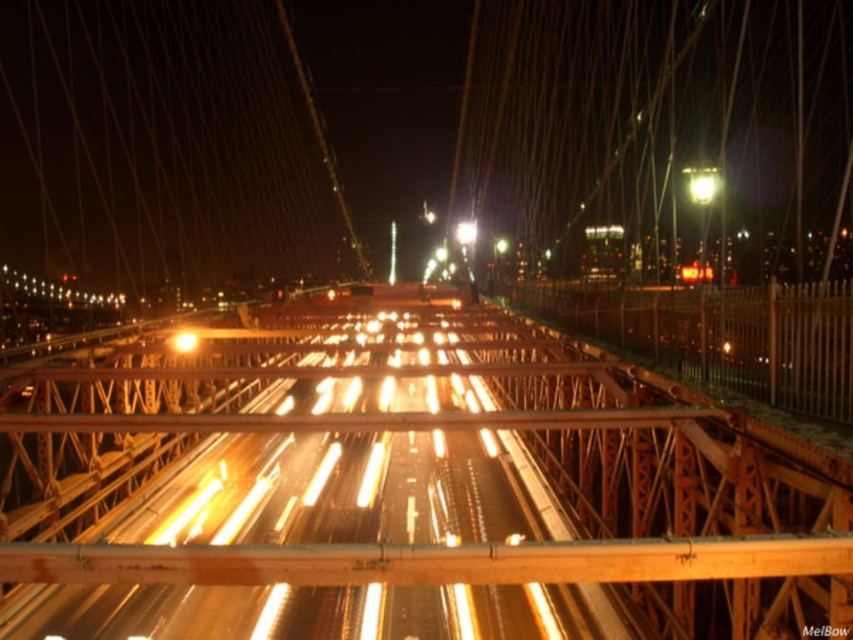
Question: Among these points, which one is farthest from the camera?

Choices:
 (A) (195, 339)
 (B) (460, 243)

Answer: (B)

Question: Can you confirm if yellow metallic light at center is positioned below bright metallic streetlight at center?

Choices:
 (A) no
 (B) yes

Answer: (B)

Question: Where is yellow metallic light at center located in relation to bright metallic streetlight at center in the image?

Choices:
 (A) below
 (B) above

Answer: (A)

Question: Which point is closer to the camera taking this photo?

Choices:
 (A) (190, 348)
 (B) (456, 234)

Answer: (A)

Question: Is yellow metallic light at center bigger than bright metallic streetlight at center?

Choices:
 (A) yes
 (B) no

Answer: (B)

Question: Which point is closer to the camera?

Choices:
 (A) (469, 228)
 (B) (181, 332)

Answer: (B)